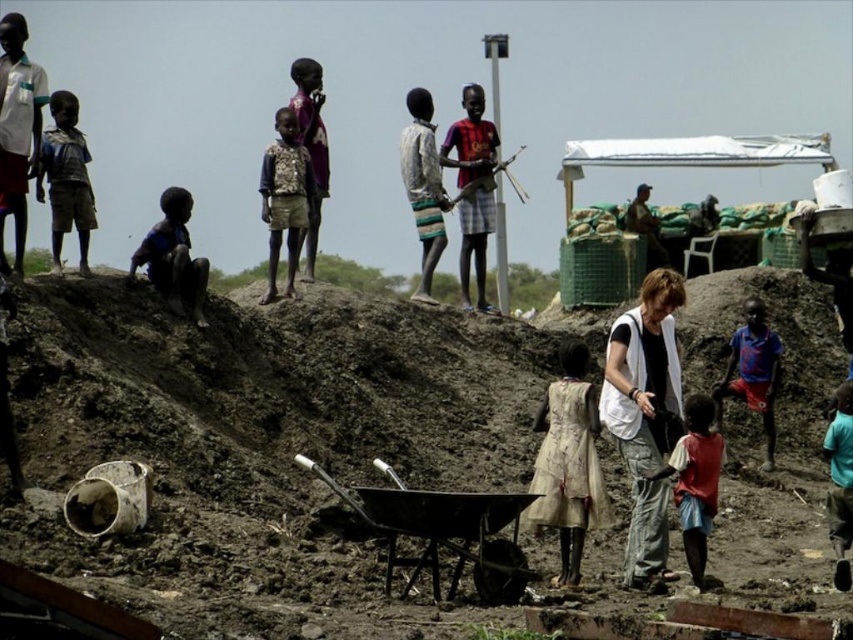
Looking at this image, between light beige fabric dress at center and striped fabric shirt at upper center, which one appears on the left side from the viewer's perspective?

From the viewer's perspective, striped fabric shirt at upper center appears more on the left side.

Is light beige fabric dress at center further to the viewer compared to striped fabric shirt at upper center?

No.

Between point (566, 580) and point (473, 147), which one is positioned behind?

Positioned behind is point (473, 147).

Where is `light beige fabric dress at center`? This screenshot has height=640, width=853. light beige fabric dress at center is located at coordinates (567, 464).

Between metallic wheelbarrow at center and striped fabric pants at upper center, which one has more height?

With more height is striped fabric pants at upper center.

Is point (457, 506) positioned behind point (416, 118)?

That is False.

Where is `metallic wheelbarrow at center`? This screenshot has height=640, width=853. metallic wheelbarrow at center is located at coordinates (442, 531).

Does point (442, 211) come behind point (314, 67)?

No, it is not.

Does striped fabric pants at upper center have a lesser width compared to matte purple shirt at upper center?

Correct, striped fabric pants at upper center's width is less than matte purple shirt at upper center's.

Which is behind, point (410, 154) or point (323, 148)?

The point (323, 148) is more distant.

Find the location of a particular element. striped fabric pants at upper center is located at coordinates (422, 186).